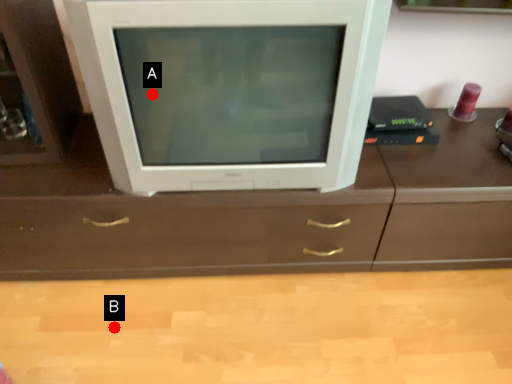
Question: Two points are circled on the image, labeled by A and B beside each circle. Which point is closer to the camera taking this photo?

Choices:
 (A) A is closer
 (B) B is closer

Answer: (A)